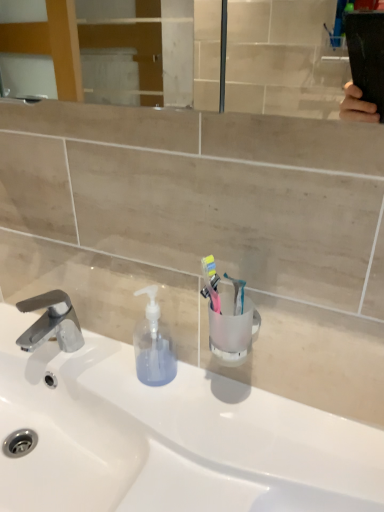
Locate an element on the screen. Image resolution: width=384 pixels, height=512 pixels. free space above white glossy sink at center (from a real-world perspective) is located at coordinates (163, 410).